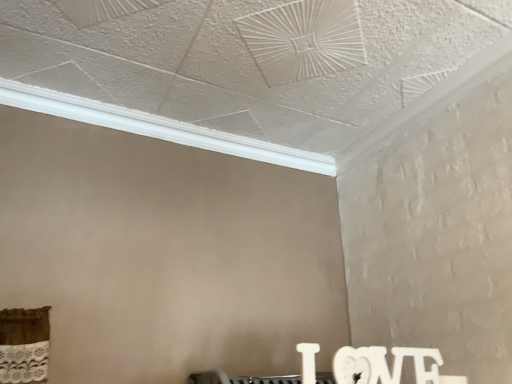
Question: Based on their sizes in the image, would you say white textured crown molding at upper center is bigger or smaller than white matte wooden letters at lower right?

Choices:
 (A) small
 (B) big

Answer: (B)

Question: From a real-world perspective, is white textured crown molding at upper center above or below white matte wooden letters at lower right?

Choices:
 (A) above
 (B) below

Answer: (A)

Question: Is white textured crown molding at upper center in front of or behind white matte wooden letters at lower right in the image?

Choices:
 (A) front
 (B) behind

Answer: (B)

Question: In the image, is white matte wooden letters at lower right positioned in front of or behind white textured crown molding at upper center?

Choices:
 (A) behind
 (B) front

Answer: (B)

Question: In terms of height, does white matte wooden letters at lower right look taller or shorter compared to white textured crown molding at upper center?

Choices:
 (A) tall
 (B) short

Answer: (A)

Question: From the image's perspective, is white matte wooden letters at lower right above or below white textured crown molding at upper center?

Choices:
 (A) above
 (B) below

Answer: (B)

Question: Would you say white matte wooden letters at lower right is to the left or to the right of white textured crown molding at upper center in the picture?

Choices:
 (A) right
 (B) left

Answer: (A)